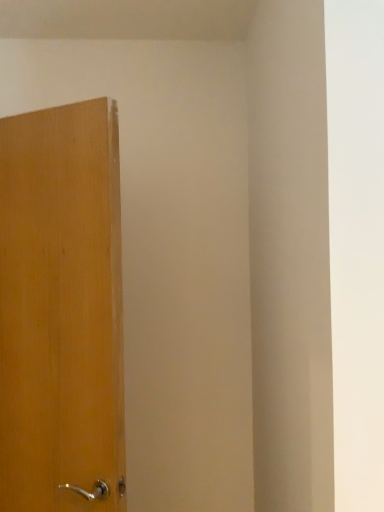
Image resolution: width=384 pixels, height=512 pixels. Describe the element at coordinates (61, 311) in the screenshot. I see `light brown wood door at left` at that location.

Locate an element on the screen. The image size is (384, 512). light brown wood door at left is located at coordinates tap(61, 311).

Consider the image. Measure the distance between point (63, 173) and camera.

They are 3.83 feet apart.

You are a GUI agent. You are given a task and a screenshot of the screen. Output one action in this format:
    pyautogui.click(x=<x>, y=<y>)
    Task: Click on the light brown wood door at left
    This screenshot has height=512, width=384.
    Given the screenshot: What is the action you would take?
    (61, 311)